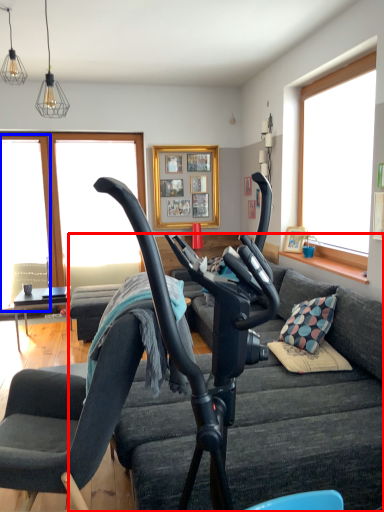
Question: Which point is closer to the camera, studio couch (highlighted by a red box) or window screen (highlighted by a blue box)?

Choices:
 (A) studio couch
 (B) window screen

Answer: (A)